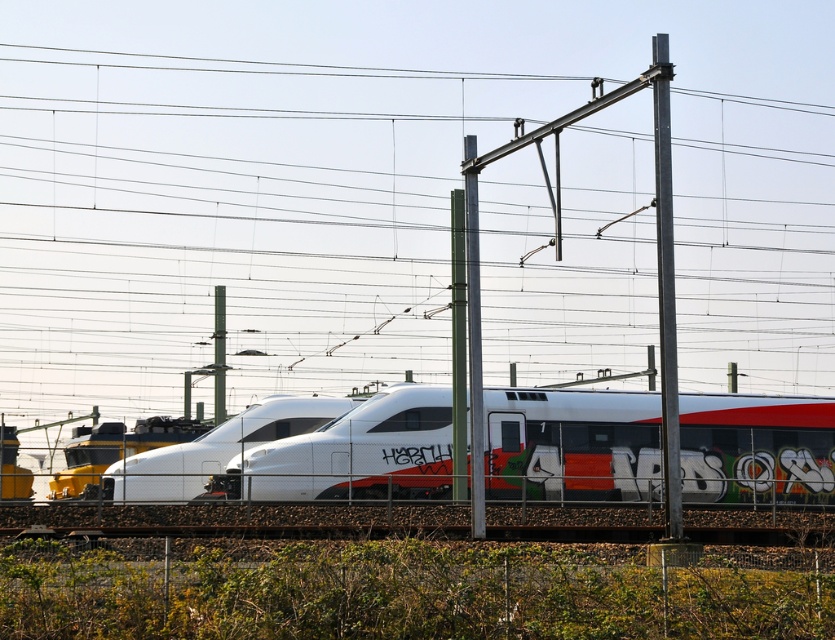
Who is higher up, white matte train at center or metallic gray pole at center?

Positioned higher is metallic gray pole at center.

Does white matte train at center have a smaller size compared to metallic gray pole at center?

No.

What do you see at coordinates (572, 444) in the screenshot?
I see `white matte train at center` at bounding box center [572, 444].

Where is `white matte train at center`? Image resolution: width=835 pixels, height=640 pixels. white matte train at center is located at coordinates (572, 444).

Is metallic gray pole at center-right positioned at the back of metallic gray pole at center?

That is False.

Can you confirm if metallic gray pole at center-right is shorter than metallic gray pole at center?

Yes.

Is point (679, 529) closer to camera compared to point (477, 401)?

Yes, point (679, 529) is in front of point (477, 401).

Find the location of a particular element. This screenshot has width=835, height=640. metallic gray pole at center-right is located at coordinates (665, 288).

Is metallic gray pole at center below metallic pole at center?

No, metallic gray pole at center is not below metallic pole at center.

You are a GUI agent. You are given a task and a screenshot of the screen. Output one action in this format:
    pyautogui.click(x=<x>, y=<y>)
    Task: Click on the metallic gray pole at center
    Image resolution: width=835 pixels, height=640 pixels.
    Given the screenshot: What is the action you would take?
    pyautogui.click(x=473, y=337)

Measure the distance between point (x=469, y=150) and camera.

A distance of 30.55 meters exists between point (x=469, y=150) and camera.

Locate an element on the screen. This screenshot has height=640, width=835. metallic gray pole at center is located at coordinates (473, 337).